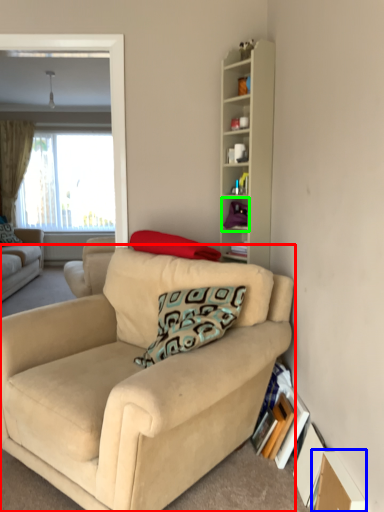
Question: Which object is positioned farthest from studio couch (highlighted by a red box)? Select from cardboard box (highlighted by a blue box) and cabinet (highlighted by a green box).

Choices:
 (A) cardboard box
 (B) cabinet

Answer: (B)